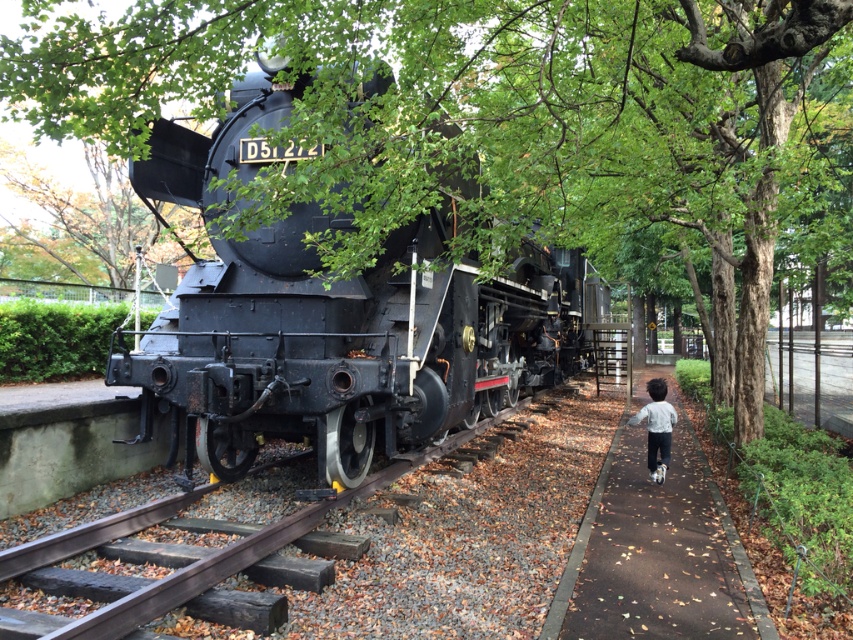
You are standing at the entrance of the park and want to take a photo of the matte black locomotive at center. According to the coordinates provided, where should you position yourself to ensure the locomotive is centered in your frame?

The matte black locomotive at center is located at point (334, 314), so positioning yourself directly in front of it at those coordinates will ensure it is centered in your photo.

You are a gardener planning to walk from the brown asphalt path at lower right to the black metal track at center. Which path is narrower for you to step onto?

The brown asphalt path at lower right is thinner than the black metal track at center, so it is narrower for you to step onto.

You are a photographer planning to take a photo of the matte black locomotive at center and the black metal track at center. Since you want to emphasize the size difference between them, which object should you focus on to highlight its dominance in the frame?

The matte black locomotive at center is larger than the black metal track at center, so focusing on the matte black locomotive at center will emphasize its dominance in the frame.